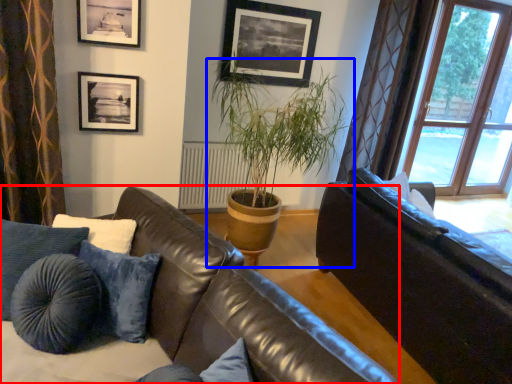
Question: Which object appears farthest to the camera in this image, studio couch (highlighted by a red box) or houseplant (highlighted by a blue box)?

Choices:
 (A) studio couch
 (B) houseplant

Answer: (B)